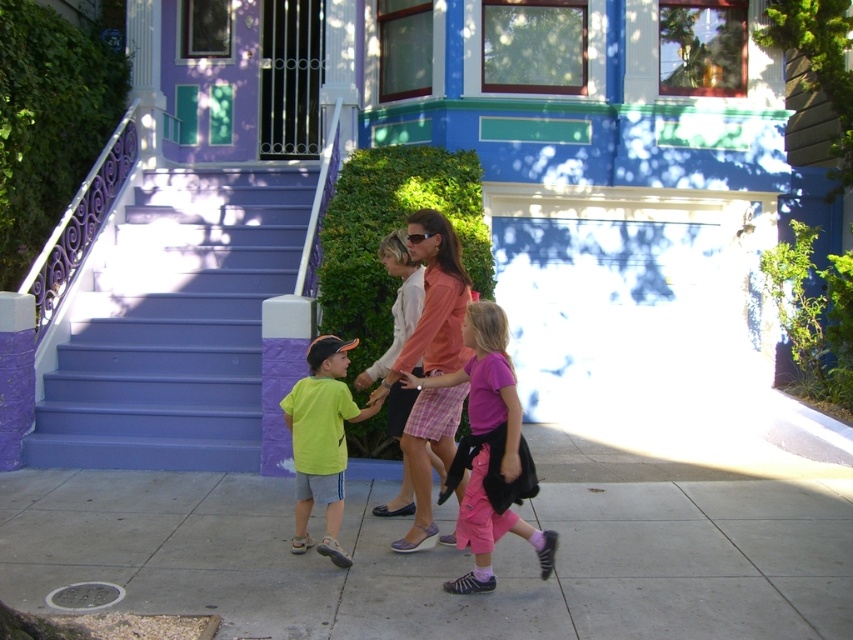
You are a delivery robot with a 1.5 meter long package. You need to place it on the gray concrete sidewalk at lower center without it overlapping the pink cotton pants at center. Is this possible?

The gray concrete sidewalk at lower center is 1.38 meters away from the pink cotton pants at center. Since the package is 1.5 meters long, placing it might cause overlap. Therefore, it is not possible to place the package without overlapping the pink cotton pants at center.